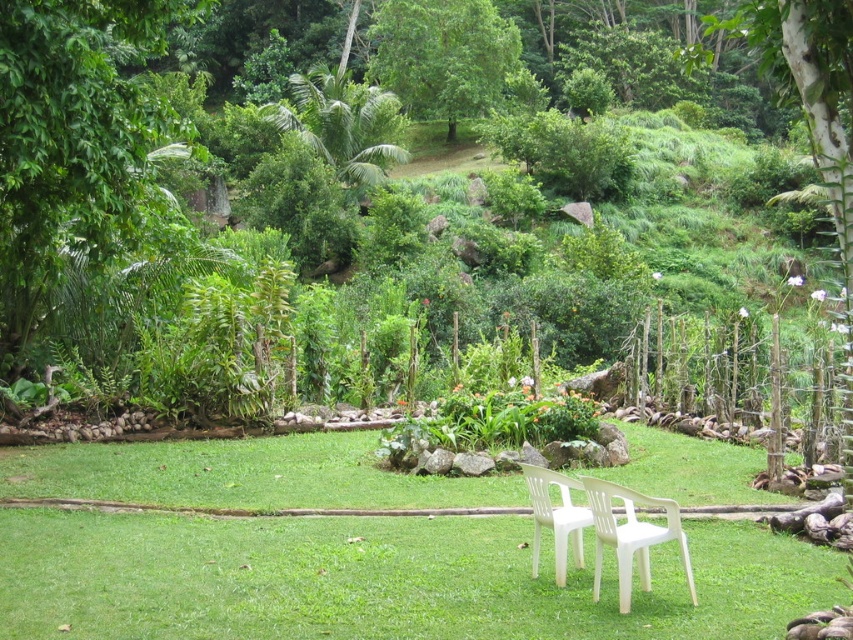
You are standing in the garden and want to take a photo of the white plastic chair at center. To avoid having the green leafy tree at upper center in the background, which direction should you move the camera?

The green leafy tree at upper center is to the left of the white plastic chair at center. To avoid the tree in the background, move the camera to the right side of the white plastic chair at center.

You are planning to install a small solar panel on the side of the green leafy tree at left. Considering the position of the white plastic chairs at center, will the tree block sunlight from reaching the solar panel during midday?

The green leafy tree at left is above the white plastic chairs at center, so during midday when the sun is high, the tree might cast a shadow over the solar panel, potentially blocking sunlight. However, the exact obstruction depends on the tree canopy density and the solar panel placement.

You are sitting on the white plastic chair at center in the garden. Looking up, you notice the green leafy tree at upper center. Can you determine if the tree is positioned above or below your current seating position?

The green leafy tree at upper center is positioned above the white plastic chair at center, so it is above your current seating position.